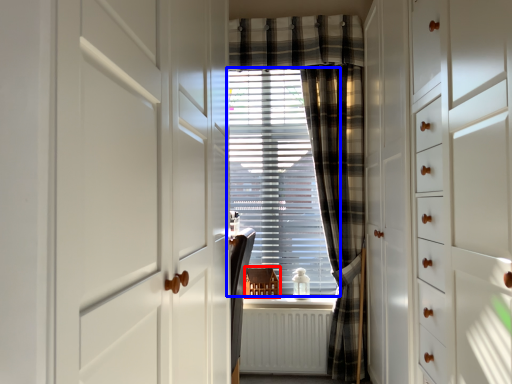
Question: Which point is closer to the camera, furniture (highlighted by a red box) or window blind (highlighted by a blue box)?

Choices:
 (A) furniture
 (B) window blind

Answer: (A)